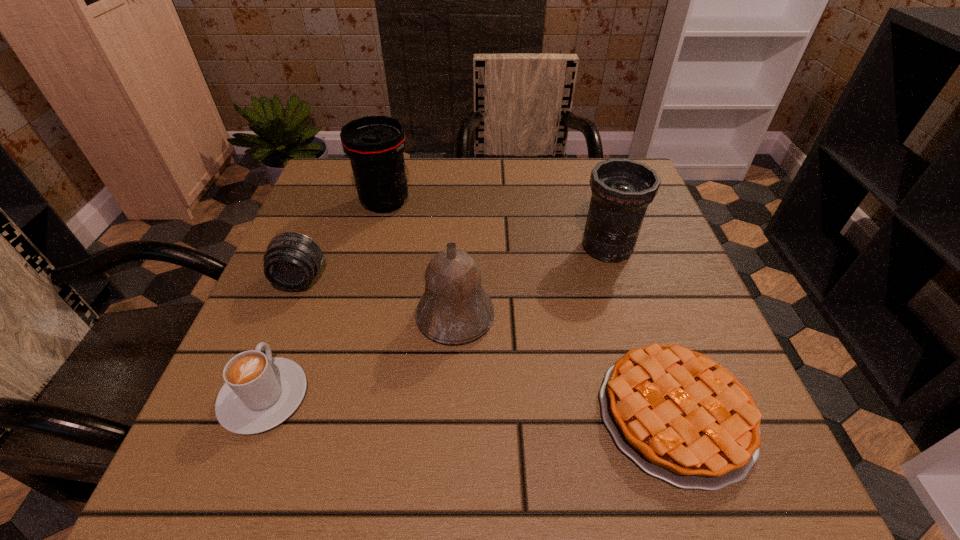
Where is `telephoto lens that is positioned at the right edge`? This screenshot has height=540, width=960. telephoto lens that is positioned at the right edge is located at coordinates (622, 189).

You are a GUI agent. You are given a task and a screenshot of the screen. Output one action in this format:
    pyautogui.click(x=<x>, y=<y>)
    Task: Click on the pie that is positioned at the right edge
    
    Given the screenshot: What is the action you would take?
    pyautogui.click(x=681, y=417)

You are a GUI agent. You are given a task and a screenshot of the screen. Output one action in this format:
    pyautogui.click(x=<x>, y=<y>)
    Task: Click on the object situated at the far left corner
    
    Given the screenshot: What is the action you would take?
    tap(375, 144)

Where is `object that is at the near left corner`? object that is at the near left corner is located at coordinates (260, 392).

The width and height of the screenshot is (960, 540). I want to click on object at the near right corner, so click(681, 417).

This screenshot has width=960, height=540. What are the coordinates of `vacant space at the far edge of the desktop` in the screenshot? It's located at (465, 198).

In order to click on free space at the near edge in this screenshot , I will do coord(354,438).

At what (x,y) coordinates should I click in order to perform the action: click on vacant space at the left edge of the desktop. Please return your answer as a coordinate pair (x, y). Looking at the image, I should click on [x=328, y=285].

Identify the location of free spot at the right edge of the desktop. The width and height of the screenshot is (960, 540). coord(653,303).

At what (x,y) coordinates should I click in order to perform the action: click on vacant space at the far left corner of the desktop. Please return your answer as a coordinate pair (x, y). The height and width of the screenshot is (540, 960). Looking at the image, I should click on click(x=346, y=193).